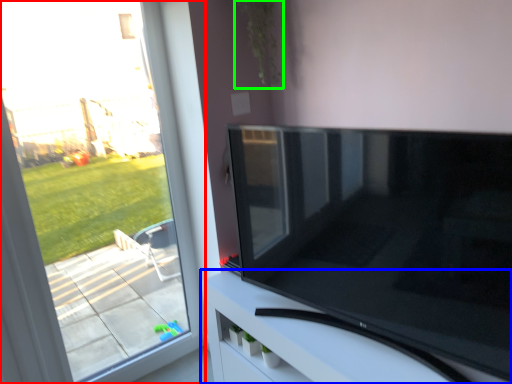
Question: Based on their relative distances, which object is nearer to window (highlighted by a red box)? Choose from furniture (highlighted by a blue box) and plant (highlighted by a green box).

Choices:
 (A) furniture
 (B) plant

Answer: (A)